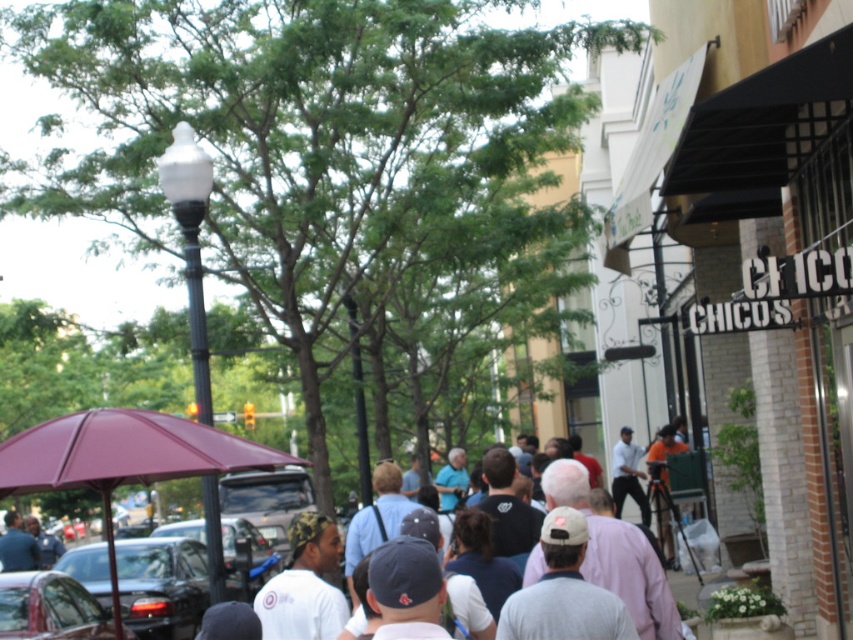
Question: Can you confirm if white cotton t-shirt at center is smaller than white cotton shirt at center?

Choices:
 (A) yes
 (B) no

Answer: (B)

Question: Is metallic silver car at lower left above white cotton shirt at center?

Choices:
 (A) no
 (B) yes

Answer: (B)

Question: Which object is closer to the camera taking this photo?

Choices:
 (A) white cotton t-shirt at center
 (B) shiny black car at center
 (C) gray cotton cap at center

Answer: (C)

Question: Which object is the closest to the gray cotton cap at center?

Choices:
 (A) shiny black car at lower left
 (B) maroon fabric umbrella at center
 (C) metallic silver car at lower left

Answer: (B)

Question: Is maroon fabric umbrella at center below metallic silver car at lower left?

Choices:
 (A) yes
 (B) no

Answer: (B)

Question: Estimate the real-world distances between objects in this image. Which object is closer to the metallic silver car at lower left?

Choices:
 (A) shiny black car at center
 (B) shiny black car at lower left
 (C) maroon fabric umbrella at center
 (D) white cotton shirt at center

Answer: (A)